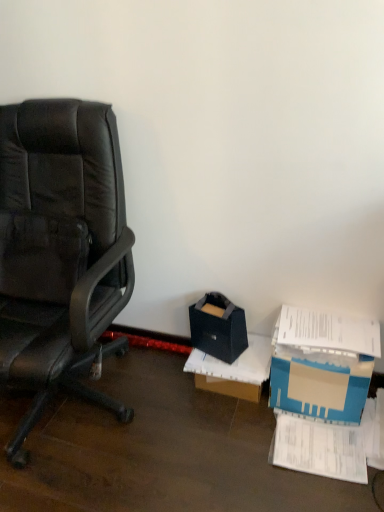
Question: Which is correct: blue cardboard box at lower right is inside matte black storage box at center, or outside of it?

Choices:
 (A) inside
 (B) outside

Answer: (B)

Question: Considering the relative positions of blue cardboard box at lower right and matte black storage box at center in the image provided, is blue cardboard box at lower right to the left or to the right of matte black storage box at center?

Choices:
 (A) right
 (B) left

Answer: (A)

Question: Which is nearer to the white paper at lower right?

Choices:
 (A) black leather office chair at left
 (B) blue cardboard box at lower right
 (C) matte black storage box at center
 (D) cardboard box at center

Answer: (B)

Question: Based on their relative distances, which object is nearer to the matte black storage box at center?

Choices:
 (A) blue cardboard box at lower right
 (B) black leather office chair at left
 (C) white paper at lower right
 (D) cardboard box at center

Answer: (D)